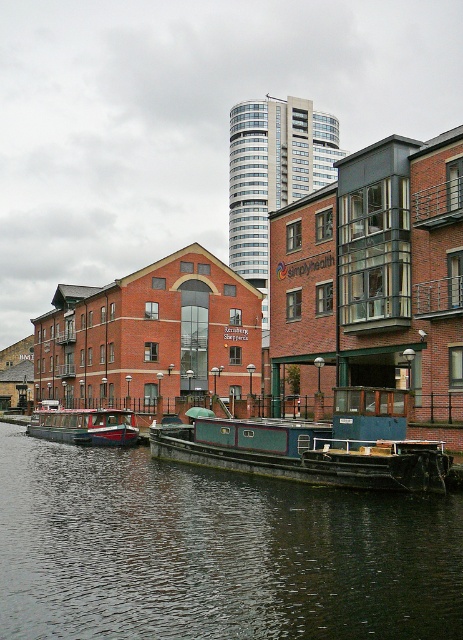
Question: Does dark green water at center lie behind teal matte barge at center?

Choices:
 (A) yes
 (B) no

Answer: (B)

Question: Is teal matte barge at center bigger than red polished wood boat at center?

Choices:
 (A) yes
 (B) no

Answer: (B)

Question: Which point appears closest to the camera in this image?

Choices:
 (A) (435, 512)
 (B) (298, 435)
 (C) (74, 424)

Answer: (A)

Question: Is dark green water at center to the right of red polished wood boat at center from the viewer's perspective?

Choices:
 (A) yes
 (B) no

Answer: (A)

Question: Which object appears farthest from the camera in this image?

Choices:
 (A) teal matte barge at center
 (B) red polished wood boat at center

Answer: (B)

Question: Which point is farther to the camera?

Choices:
 (A) teal matte barge at center
 (B) dark green water at center
 (C) red polished wood boat at center

Answer: (C)